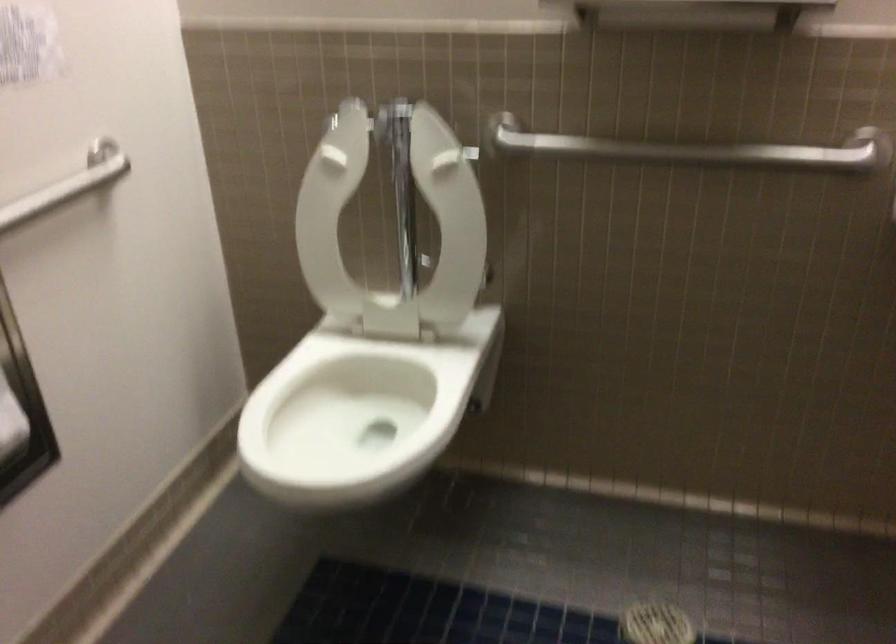
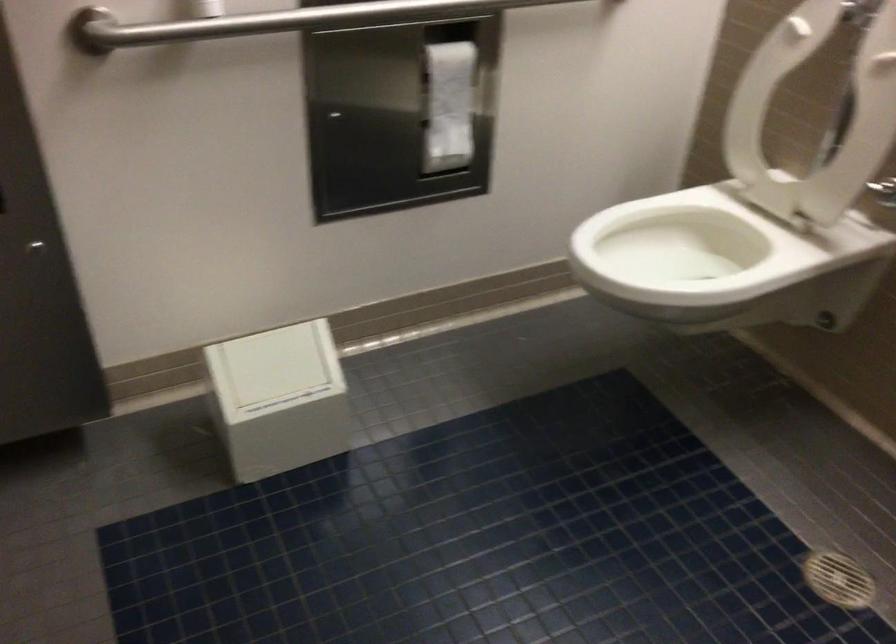
Where in the second image is the point corresponding to (x=476, y=406) from the first image?

(824, 321)